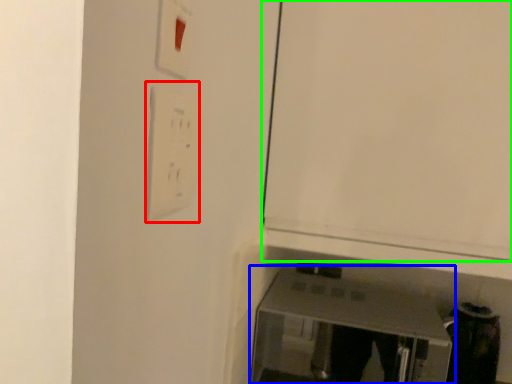
Question: Considering the real-world distances, which object is closest to light switch (highlighted by a red box)? furniture (highlighted by a blue box) or door (highlighted by a green box).

Choices:
 (A) furniture
 (B) door

Answer: (B)